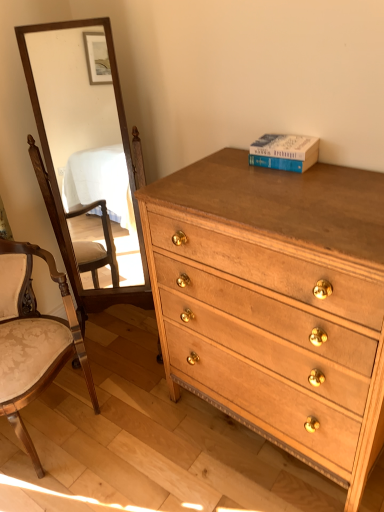
You are a GUI agent. You are given a task and a screenshot of the screen. Output one action in this format:
    pyautogui.click(x=<x>, y=<y>)
    Task: Click on the vacant space underneath wooden upholstered chair at left (from a real-world perspective)
    The height and width of the screenshot is (512, 384).
    Given the screenshot: What is the action you would take?
    pyautogui.click(x=57, y=417)